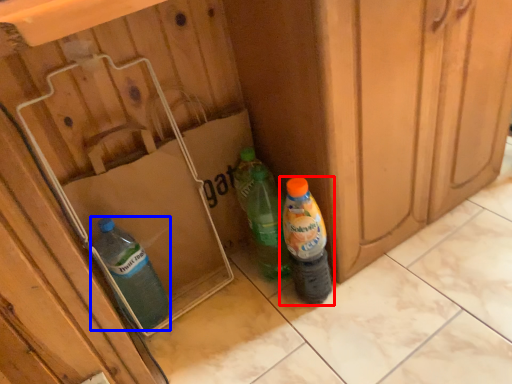
Question: Among these objects, which one is farthest to the camera, bottle (highlighted by a red box) or bottle (highlighted by a blue box)?

Choices:
 (A) bottle
 (B) bottle

Answer: (B)